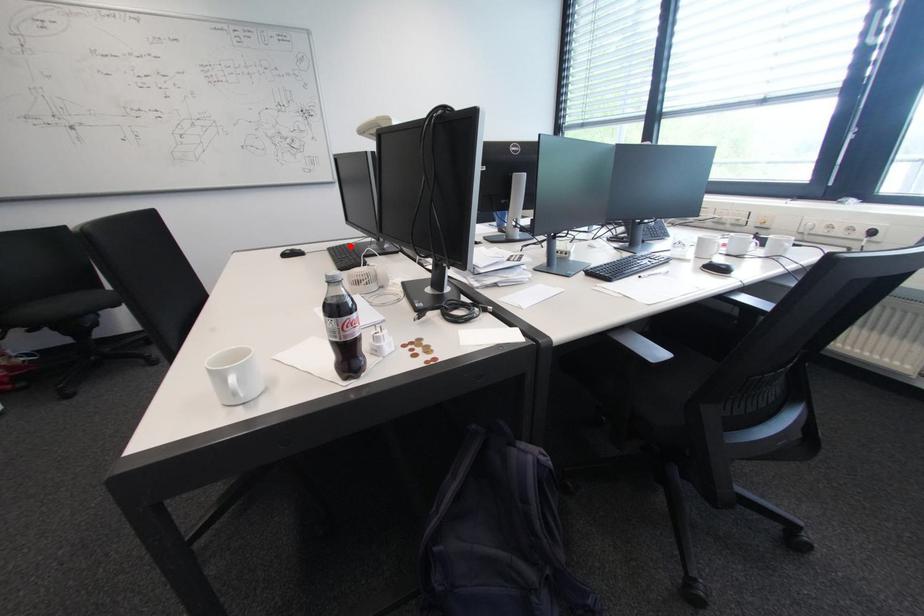
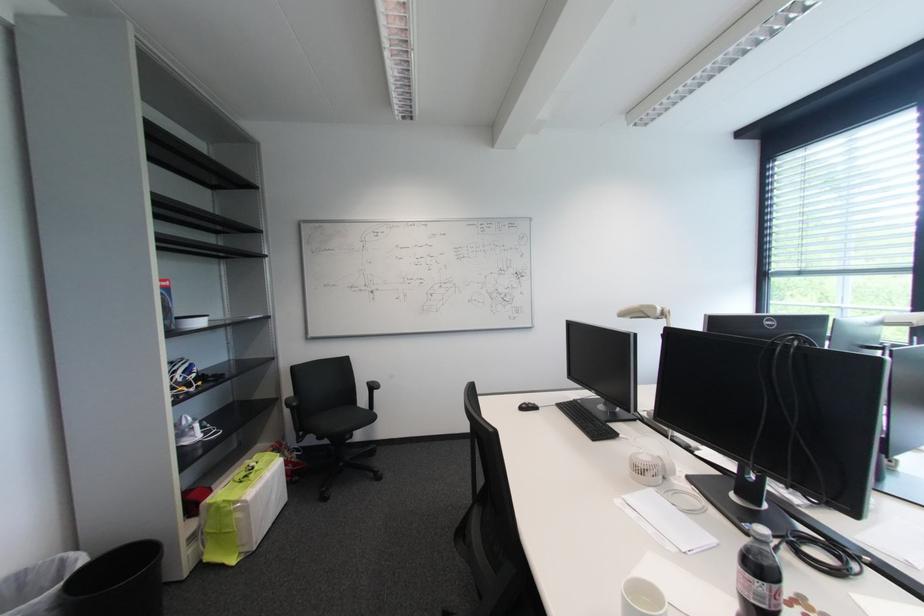
In the second image, find the point that corresponds to the highlighted location in the first image.

(578, 403)